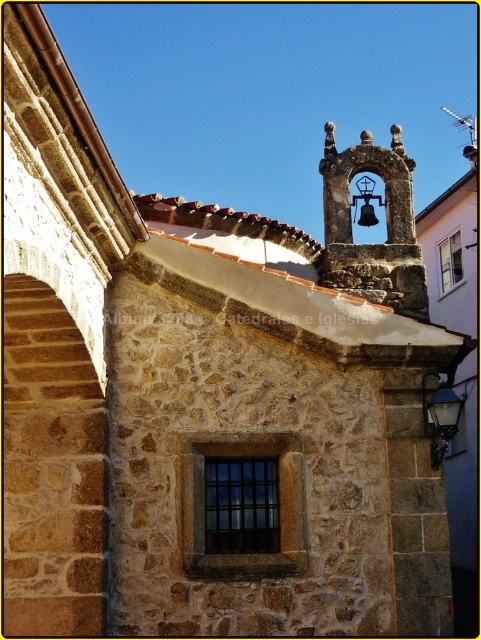
Question: Estimate the real-world distances between objects in this image. Which object is farther from the brown stone window at center?

Choices:
 (A) black glass window at center
 (B) white glass window at upper right

Answer: (B)

Question: Which of the following is the closest to the observer?

Choices:
 (A) (253, 502)
 (B) (295, 490)

Answer: (B)

Question: Is black glass window at center to the left of white glass window at upper right from the viewer's perspective?

Choices:
 (A) yes
 (B) no

Answer: (A)

Question: Does brown stone window at center have a smaller size compared to black glass window at center?

Choices:
 (A) yes
 (B) no

Answer: (A)

Question: Is brown stone window at center further to camera compared to black glass window at center?

Choices:
 (A) no
 (B) yes

Answer: (B)

Question: Based on their relative distances, which object is nearer to the black glass window at center?

Choices:
 (A) brown stone window at center
 (B) white glass window at upper right

Answer: (A)